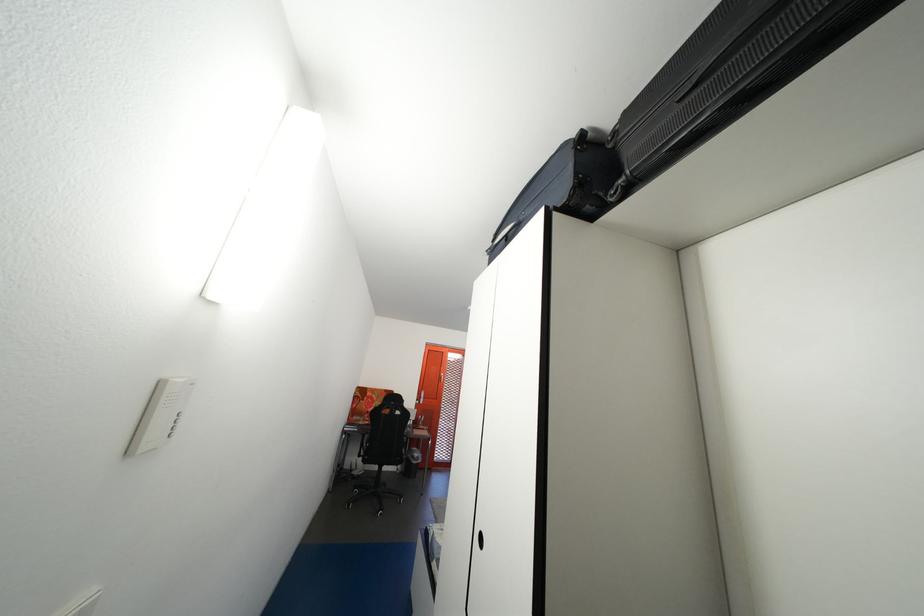
Find where to turn the orange door handle. Please return your answer as a coordinate pair (x, y).

(429, 399)